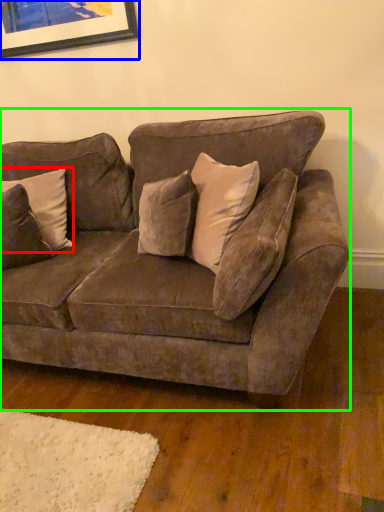
Question: Estimate the real-world distances between objects in this image. Which object is closer to pillow (highlighted by a red box), picture frame (highlighted by a blue box) or studio couch (highlighted by a green box)?

Choices:
 (A) picture frame
 (B) studio couch

Answer: (B)